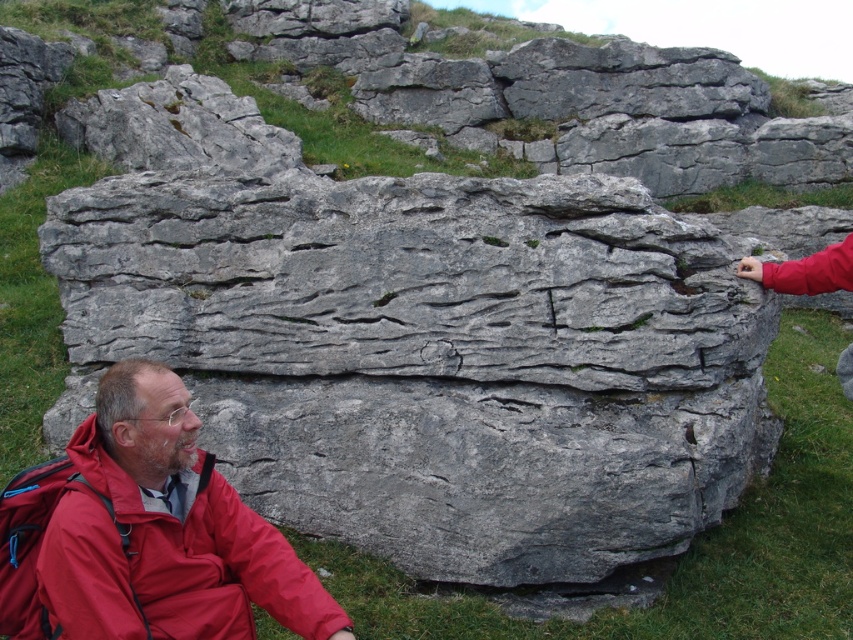
Does gray rock at center appear on the left side of red nylon jacket at lower left?

Incorrect, gray rock at center is not on the left side of red nylon jacket at lower left.

At what (x,y) coordinates should I click in order to perform the action: click on gray rock at center. Please return your answer as a coordinate pair (x, y). The width and height of the screenshot is (853, 640). Looking at the image, I should click on (576, 102).

Image resolution: width=853 pixels, height=640 pixels. Identify the location of gray rock at center. (576, 102).